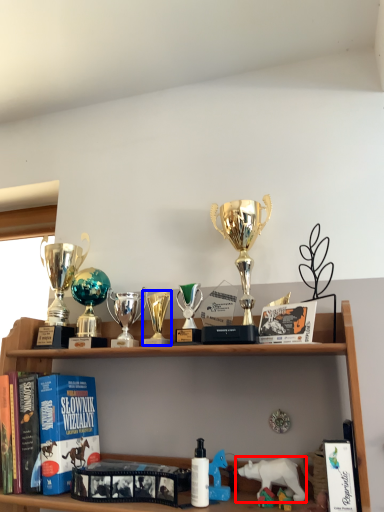
Question: Among these objects, which one is nearest to the camera, animal (highlighted by a red box) or toy (highlighted by a blue box)?

Choices:
 (A) animal
 (B) toy

Answer: (A)